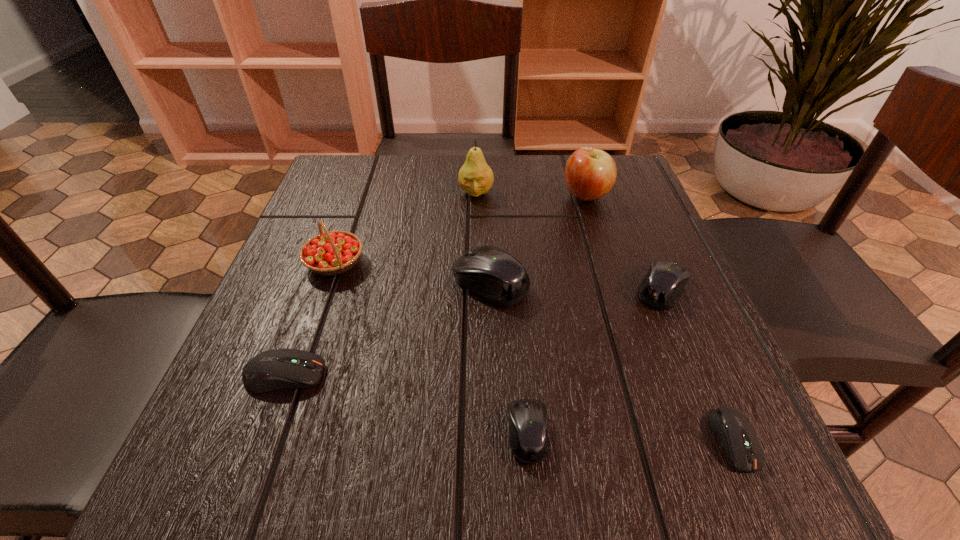
Find the location of `vacant space at the far left corner of the desktop`. vacant space at the far left corner of the desktop is located at coordinates (346, 179).

Find the location of a particular element. free spot at the far right corner of the desktop is located at coordinates (624, 159).

This screenshot has height=540, width=960. Find the location of `free space at the near right corner of the desktop`. free space at the near right corner of the desktop is located at coordinates (770, 488).

The width and height of the screenshot is (960, 540). Identify the location of unoccupied position between the tallest object and the left dark computer equipment. (380, 284).

At what (x,y) coordinates should I click in order to perform the action: click on vacant space that is in between the nearer dark computer equipment and the apple. Please return your answer as a coordinate pair (x, y). This screenshot has width=960, height=540. Looking at the image, I should click on coord(660,318).

I want to click on free spot between the strawberry and the tallest computer equipment, so 413,273.

The width and height of the screenshot is (960, 540). Find the location of `empty space that is in between the nearest black mouse and the farther dark computer equipment`. empty space that is in between the nearest black mouse and the farther dark computer equipment is located at coordinates (406, 404).

Where is `free space between the shortest computer equipment and the seventh shortest object`? Image resolution: width=960 pixels, height=540 pixels. free space between the shortest computer equipment and the seventh shortest object is located at coordinates (660, 318).

Find the location of a particular element. vacant space in between the farther dark computer equipment and the rightmost black mouse is located at coordinates (473, 332).

You are a GUI agent. You are given a task and a screenshot of the screen. Output one action in this format:
    pyautogui.click(x=<x>, y=<y>)
    Task: Click on the vacant space that is in between the tallest object and the second tallest computer equipment
    The width and height of the screenshot is (960, 540).
    Given the screenshot: What is the action you would take?
    pyautogui.click(x=569, y=240)